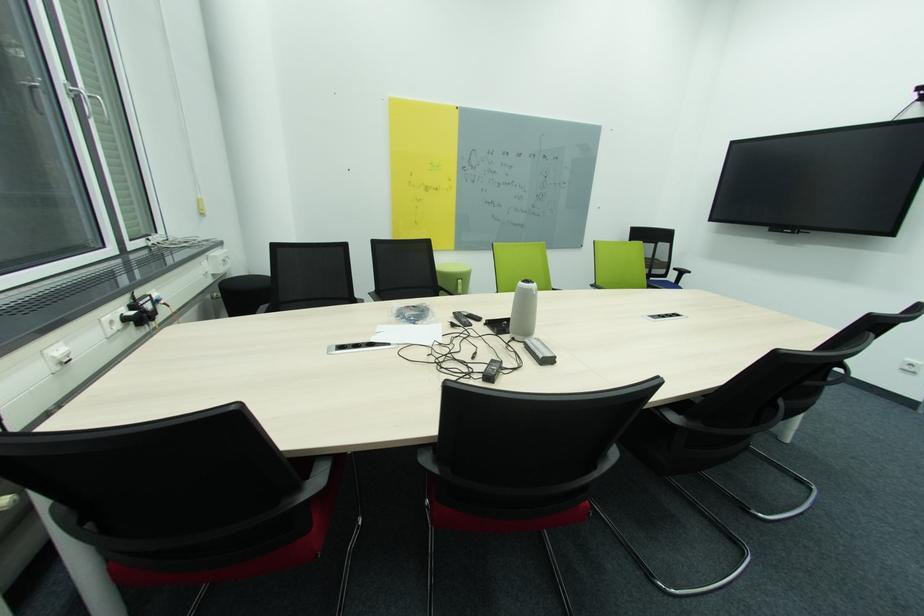
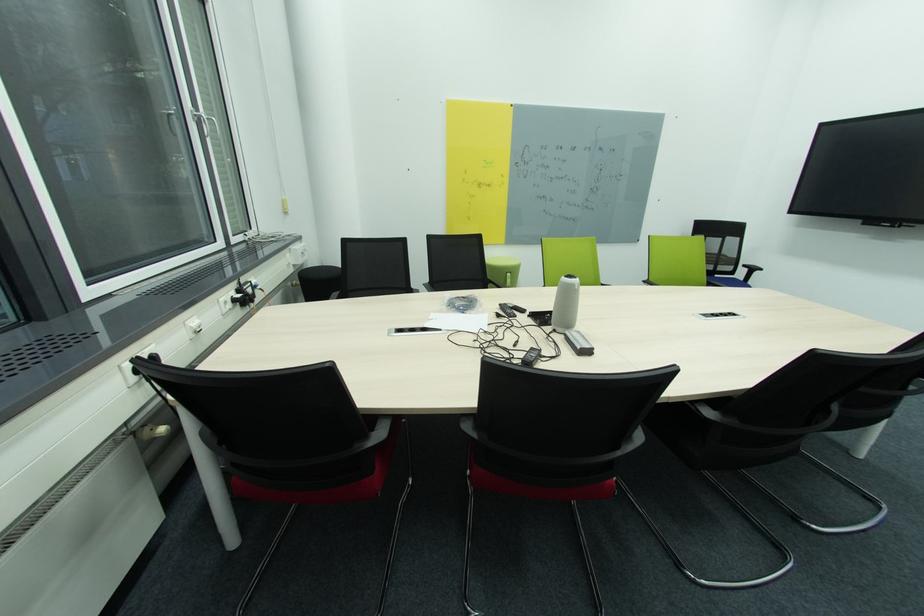
Find the pixel in the second image that matches [394,345] in the first image.

(444, 331)